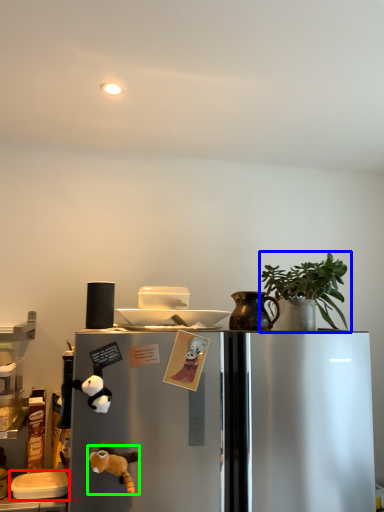
Question: Estimate the real-world distances between objects in this image. Which object is closer to appliance (highlighted by a red box), houseplant (highlighted by a blue box) or toy (highlighted by a green box)?

Choices:
 (A) houseplant
 (B) toy

Answer: (B)